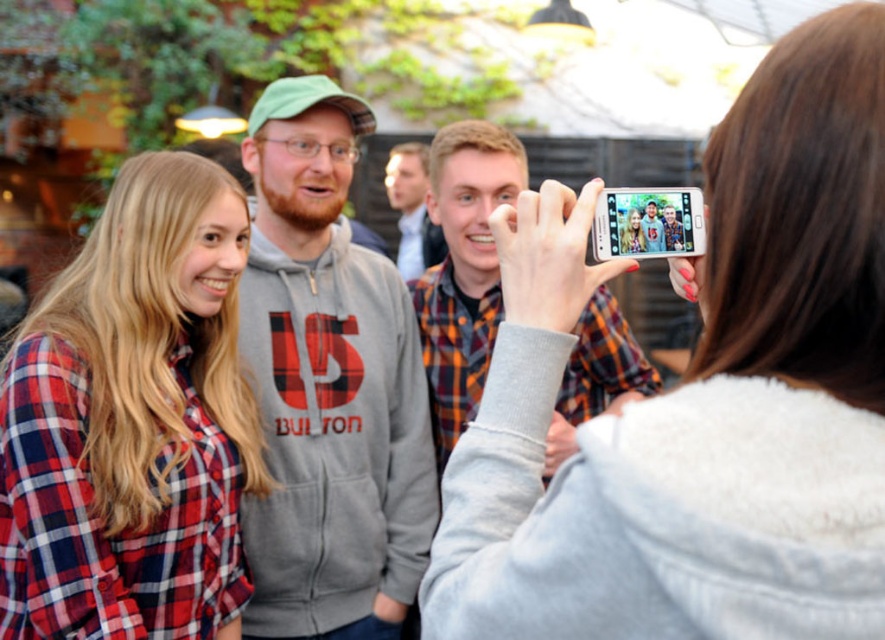
Question: Is red plaid shirt at left positioned before flannel shirt at center?

Choices:
 (A) yes
 (B) no

Answer: (A)

Question: Is orange plaid shirt at center to the left of silver metallic phone at upper right from the viewer's perspective?

Choices:
 (A) yes
 (B) no

Answer: (A)

Question: Which of the following is the closest to the observer?

Choices:
 (A) gray fleece hoodie at center
 (B) orange plaid shirt at center
 (C) flannel shirt at center

Answer: (A)

Question: Estimate the real-world distances between objects in this image. Which object is farther from the gray fleece hoodie at center?

Choices:
 (A) silver metallic phone at upper right
 (B) orange plaid shirt at center
 (C) white glossy phone at upper center

Answer: (C)

Question: Does gray fleece hoodie at center come in front of flannel shirt at center?

Choices:
 (A) yes
 (B) no

Answer: (A)

Question: Which object appears closest to the camera in this image?

Choices:
 (A) red plaid shirt at left
 (B) orange plaid shirt at center

Answer: (A)